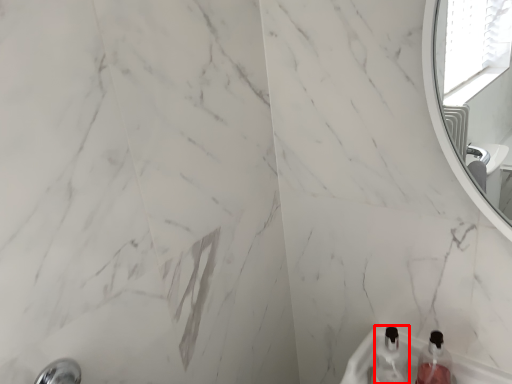
Question: From the image's perspective, what is the correct spatial relationship of bottle (annotated by the red box) in relation to bottle?

Choices:
 (A) above
 (B) below

Answer: (A)